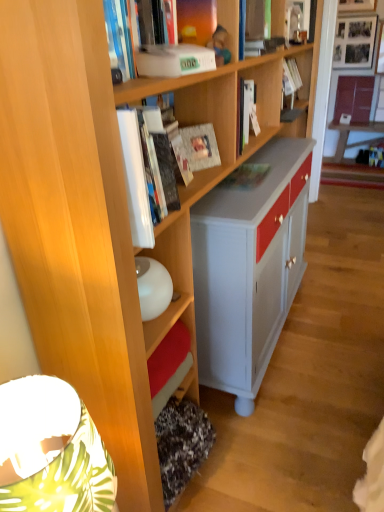
Question: Is the depth of matte brown book at upper right, placed as the 5th book when sorted from front to back, greater than that of matte green book at center, the 3th book when ordered from right to left?

Choices:
 (A) no
 (B) yes

Answer: (B)

Question: Is matte brown book at upper right, placed as the 5th book when sorted from front to back, wider than matte green book at center, which is the third book in left-to-right order?

Choices:
 (A) yes
 (B) no

Answer: (B)

Question: Could you tell me if matte brown book at upper right, placed as the 5th book when sorted from left to right, is turned towards matte green book at center, the 3th book viewed from the back?

Choices:
 (A) no
 (B) yes

Answer: (B)

Question: Can you confirm if matte brown book at upper right, placed as the 5th book when sorted from front to back, is positioned to the left of matte green book at center, the third book positioned from the front?

Choices:
 (A) no
 (B) yes

Answer: (A)

Question: From the image's perspective, is matte brown book at upper right, which is counted as the 1th book, starting from the back, located above matte green book at center, the 3th book when ordered from right to left?

Choices:
 (A) no
 (B) yes

Answer: (B)

Question: Considering the positions of matte paper at center, the second paperback book positioned from the front, and hardcover book at upper center, the 4th book from the left, in the image, is matte paper at center, the second paperback book positioned from the front, bigger or smaller than hardcover book at upper center, the 4th book from the left,?

Choices:
 (A) small
 (B) big

Answer: (A)

Question: From the image's perspective, is matte paper at center, which is counted as the 1th paperback book, starting from the back, located above or below hardcover book at upper center, the 4th book from the left?

Choices:
 (A) above
 (B) below

Answer: (B)

Question: Is matte paper at center, the second paperback book positioned from the front, in front of or behind hardcover book at upper center, marked as the second book in a top-to-bottom arrangement, in the image?

Choices:
 (A) behind
 (B) front

Answer: (B)

Question: Visually, is matte paper at center, the second paperback book positioned from the front, positioned to the left or to the right of hardcover book at upper center, the 4th book from the left?

Choices:
 (A) right
 (B) left

Answer: (B)

Question: In the image, is hardcover book at upper center, the 4th book from the left, on the left side or the right side of white glossy book at upper center, positioned as the 4th book in top-to-bottom order?

Choices:
 (A) left
 (B) right

Answer: (B)

Question: Considering their positions, is hardcover book at upper center, marked as the second book in a top-to-bottom arrangement, located in front of or behind white glossy book at upper center, the first book positioned from the left?

Choices:
 (A) front
 (B) behind

Answer: (B)

Question: Considering the positions of hardcover book at upper center, the fourth book in the bottom-to-top sequence, and white glossy book at upper center, arranged as the 5th book when viewed from the back, in the image, is hardcover book at upper center, the fourth book in the bottom-to-top sequence, wider or thinner than white glossy book at upper center, arranged as the 5th book when viewed from the back,?

Choices:
 (A) wide
 (B) thin

Answer: (B)

Question: From the image's perspective, is hardcover book at upper center, the second book in the back-to-front sequence, positioned above or below white glossy book at upper center, arranged as the 5th book when viewed from the back?

Choices:
 (A) below
 (B) above

Answer: (B)

Question: Considering the positions of matte green book at center, arranged as the 5th book when viewed from the top, and white glossy book at upper center, which is counted as the 2th book, starting from the bottom, in the image, is matte green book at center, arranged as the 5th book when viewed from the top, taller or shorter than white glossy book at upper center, which is counted as the 2th book, starting from the bottom,?

Choices:
 (A) short
 (B) tall

Answer: (A)

Question: In terms of size, does matte green book at center, placed as the 1th book when sorted from bottom to top, appear bigger or smaller than white glossy book at upper center, the first book positioned from the left?

Choices:
 (A) big
 (B) small

Answer: (B)